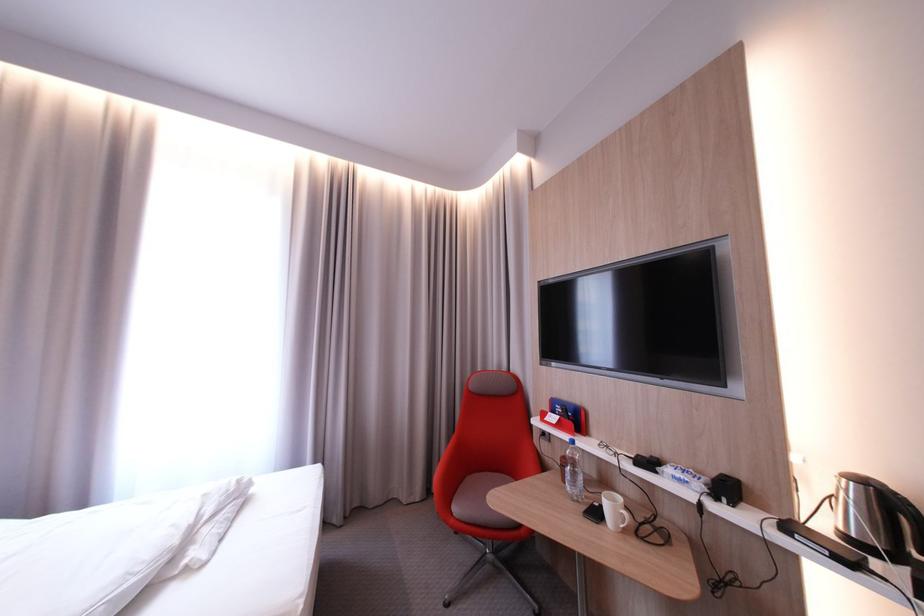
Identify the location of black kettle handle. (910, 517).